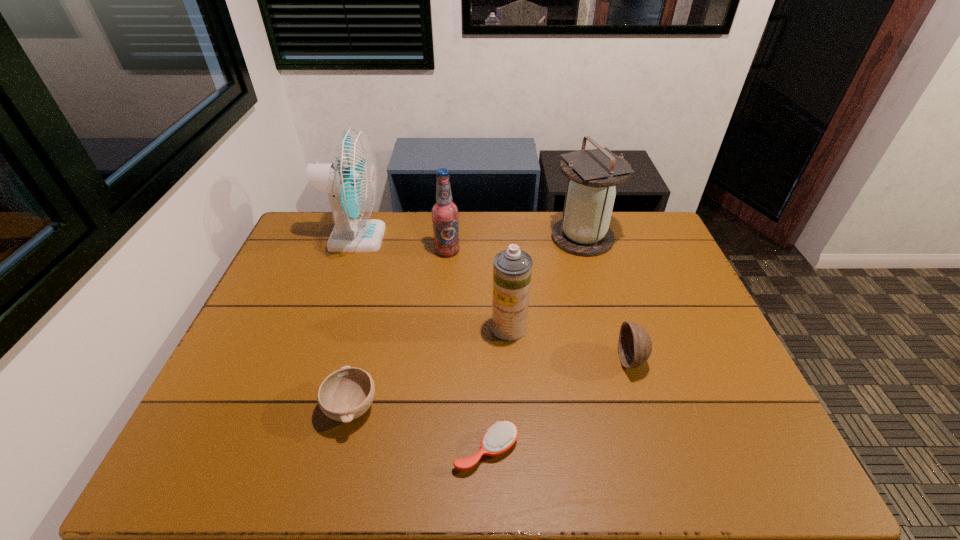
This screenshot has height=540, width=960. In order to click on vacant space located on the left of the lantern in this screenshot , I will do `click(532, 238)`.

The height and width of the screenshot is (540, 960). Find the location of `free location located on the right of the alcohol`. free location located on the right of the alcohol is located at coordinates (540, 251).

I want to click on vacant space located on the right of the fourth farthest object, so click(544, 328).

Locate an element on the screen. This screenshot has height=540, width=960. free region located on the back of the taller bowl is located at coordinates (606, 279).

Find the location of a particular element. The height and width of the screenshot is (540, 960). free space located on the back of the left bowl is located at coordinates (378, 296).

Image resolution: width=960 pixels, height=540 pixels. Find the location of `vacant space positioned on the back of the hairbrush`. vacant space positioned on the back of the hairbrush is located at coordinates (486, 363).

I want to click on fan situated at the far edge, so click(x=351, y=180).

Locate an element on the screen. Image resolution: width=960 pixels, height=540 pixels. lantern located in the far edge section of the desktop is located at coordinates (584, 230).

Locate an element on the screen. alcohol that is positioned at the far edge is located at coordinates (444, 212).

Find the location of `object positioned at the near edge`. object positioned at the near edge is located at coordinates (499, 438).